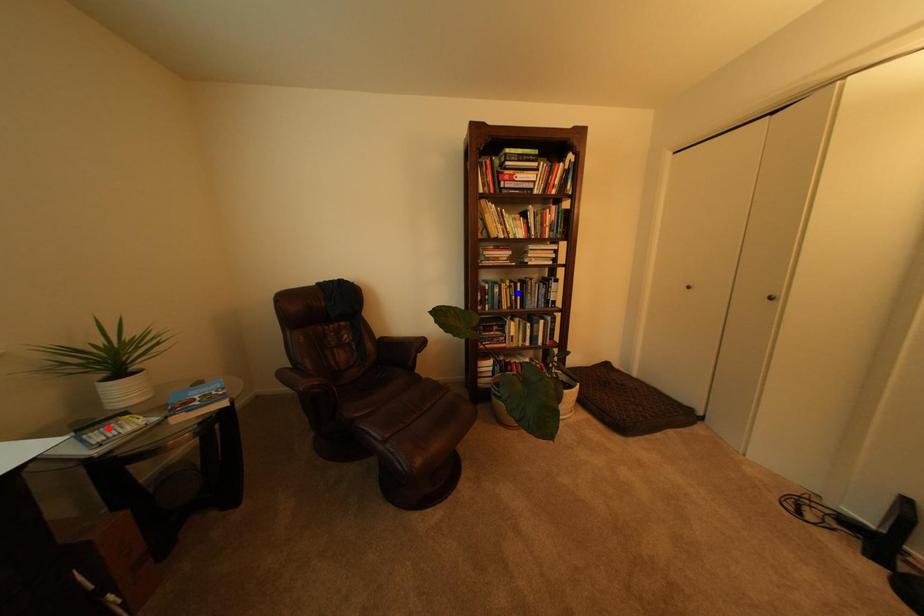
Question: Which of the two points in the image is closer to the camera?

Choices:
 (A) Blue point is closer.
 (B) Red point is closer.

Answer: (B)